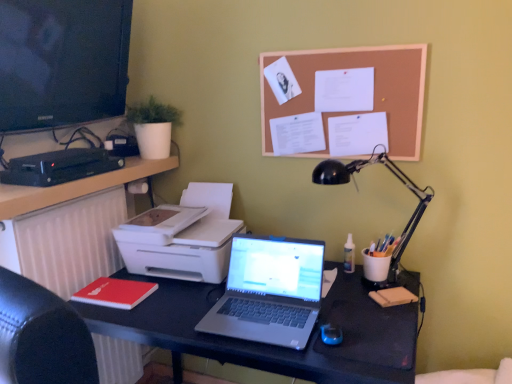
Where is `vacant area situated below black metal desk lamp at right (from a real-world perspective)`? This screenshot has width=512, height=384. vacant area situated below black metal desk lamp at right (from a real-world perspective) is located at coordinates (365, 284).